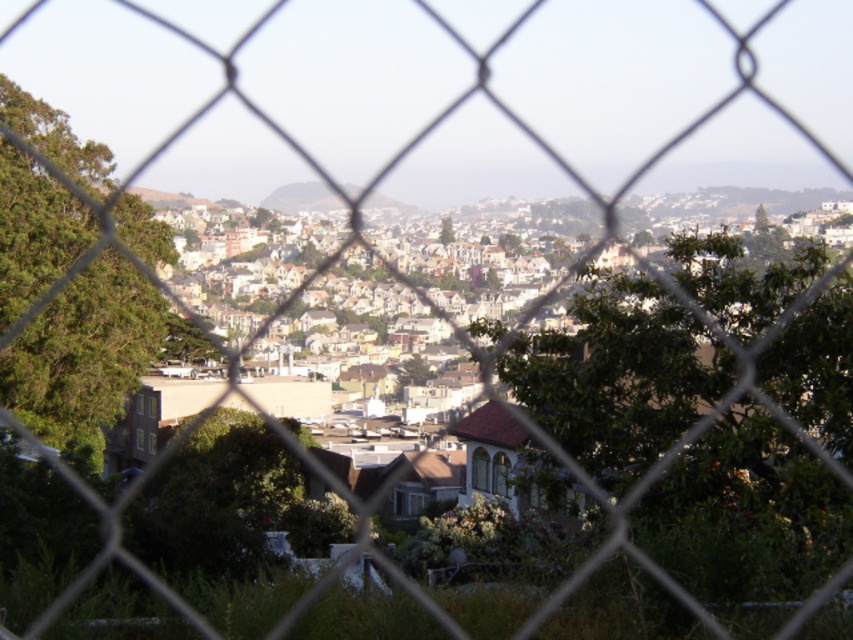
Question: Observing the image, what is the correct spatial positioning of green leafy tree at left in reference to green grassy hillside at center?

Choices:
 (A) above
 (B) below

Answer: (B)

Question: Which object is closer to the camera taking this photo?

Choices:
 (A) green leafy tree at left
 (B) green leafy tree at center

Answer: (B)

Question: Can you confirm if green leafy tree at left is positioned above green matte tree at center?

Choices:
 (A) no
 (B) yes

Answer: (A)

Question: Which point is farther from the camera taking this photo?

Choices:
 (A) (605, 454)
 (B) (440, 227)
 (C) (44, 278)

Answer: (B)

Question: Estimate the real-world distances between objects in this image. Which object is farther from the green leafy tree at center?

Choices:
 (A) green leafy tree at left
 (B) green grassy hillside at center

Answer: (B)

Question: Is green leafy tree at left positioned in front of green matte tree at center?

Choices:
 (A) no
 (B) yes

Answer: (B)